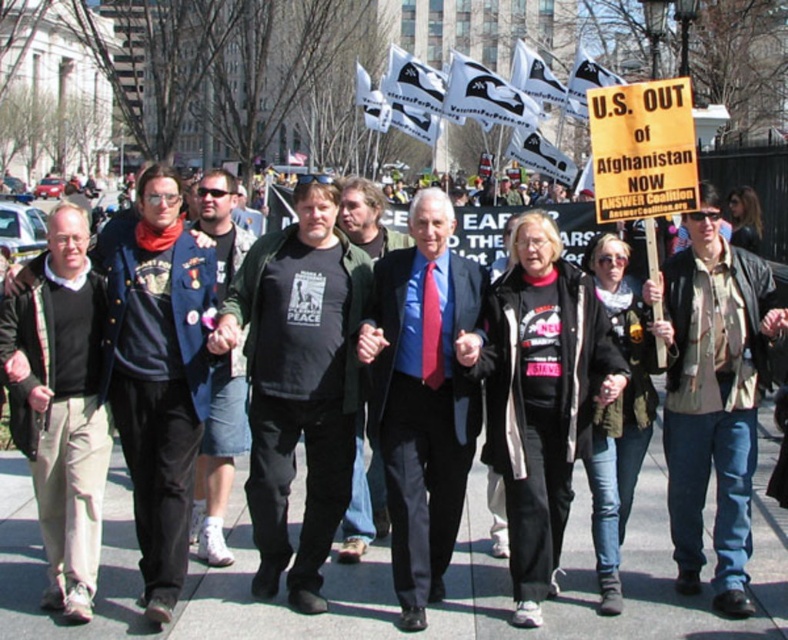
Question: Is black matte t-shirt at center above dark blue jacket at left?

Choices:
 (A) no
 (B) yes

Answer: (A)

Question: Which object is positioned closest to the denim shorts at center?

Choices:
 (A) black matte t-shirt at center
 (B) matte black suit at center
 (C) khaki cotton jacket at center

Answer: (A)

Question: Is dark blue jacket at left below denim shorts at center?

Choices:
 (A) yes
 (B) no

Answer: (B)

Question: Which of the following is the closest to the observer?

Choices:
 (A) dark blue jacket at left
 (B) khaki cotton jacket at center
 (C) denim shorts at center
 (D) black matte t-shirt at center

Answer: (A)

Question: Which point is farther to the camera?

Choices:
 (A) (220, 454)
 (B) (277, 588)
 (C) (180, 529)
 (D) (664, 397)

Answer: (D)

Question: Can you confirm if black matte t-shirt at center is smaller than khaki cotton jacket at center?

Choices:
 (A) yes
 (B) no

Answer: (B)